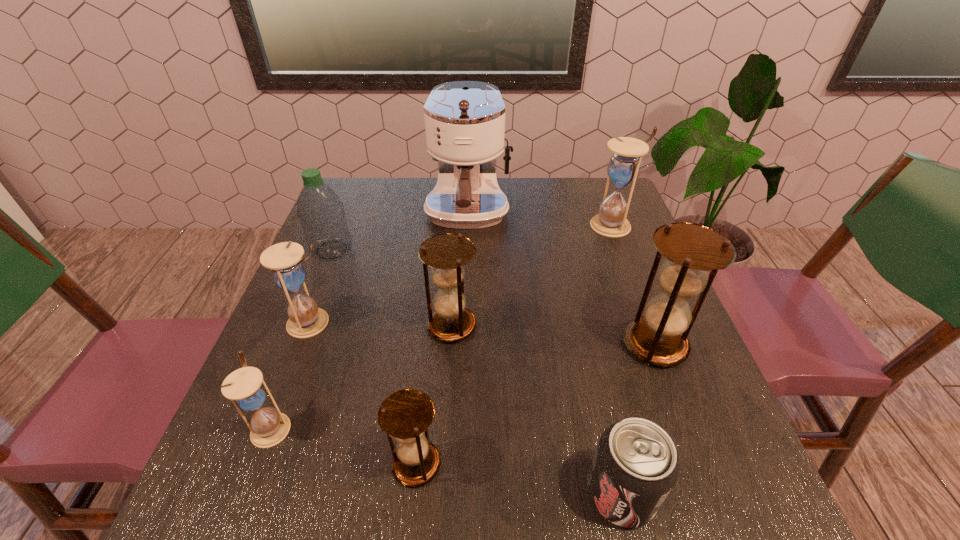
Where is `unoccupied area between the second nearest white hourglass and the rightmost brown hourglass`? unoccupied area between the second nearest white hourglass and the rightmost brown hourglass is located at coordinates (483, 333).

Image resolution: width=960 pixels, height=540 pixels. What are the coordinates of `free space between the biggest brown hourglass and the second biggest brown hourglass` in the screenshot? It's located at (553, 335).

You are a GUI agent. You are given a task and a screenshot of the screen. Output one action in this format:
    pyautogui.click(x=<x>, y=<y>)
    Task: Click on the vacant space in between the water bottle and the seventh object from left to right
    Image resolution: width=960 pixels, height=540 pixels.
    Given the screenshot: What is the action you would take?
    pyautogui.click(x=476, y=372)

I want to click on unoccupied area between the smallest white hourglass and the coffee maker, so click(x=370, y=321).

The width and height of the screenshot is (960, 540). Identify the location of vacant area that lies between the coffee maker and the soda can. click(x=544, y=354).

Identify which object is located as the fourth nearest to the tallest object. Please provide its 2D coordinates. Your answer should be formatted as a tuple, i.e. [(x, y)], where the tuple contains the x and y coordinates of a point satisfying the conditions above.

[(305, 320)]

The width and height of the screenshot is (960, 540). Find the location of `object that can be found as the fifth closest to the water bottle`. object that can be found as the fifth closest to the water bottle is located at coordinates (405, 415).

This screenshot has height=540, width=960. I want to click on hourglass object that ranks as the fifth closest to the farthest hourglass, so pos(245,387).

Locate an element on the screen. The width and height of the screenshot is (960, 540). hourglass that is the fourth nearest to the second nearest white hourglass is located at coordinates (659, 337).

The height and width of the screenshot is (540, 960). In order to click on the second closest white hourglass to the second biggest brown hourglass in this screenshot , I will do `click(245, 387)`.